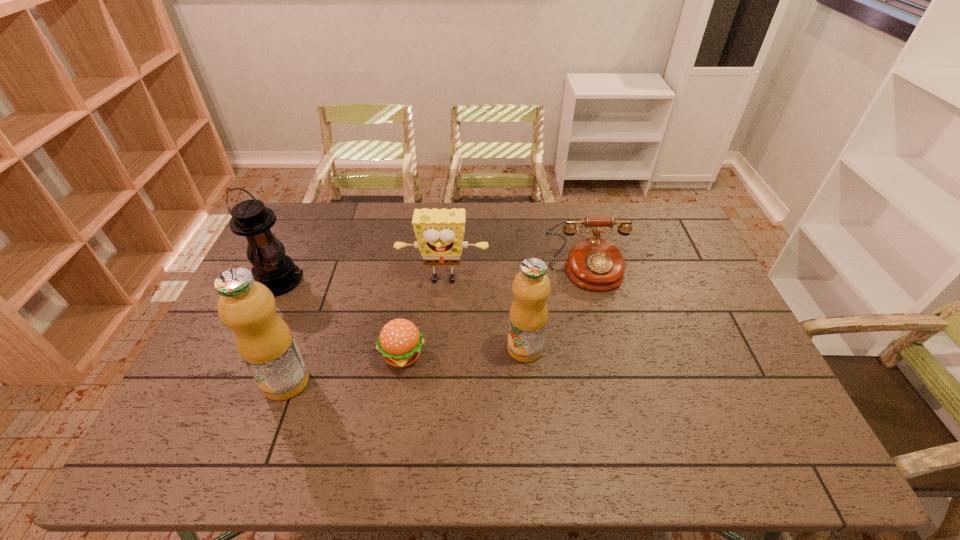
Identify the location of vacant space that satisfies the following two spatial constraints: 1. on the back side of the shortest object; 2. above the lantern, indicating its light source. [x=414, y=281].